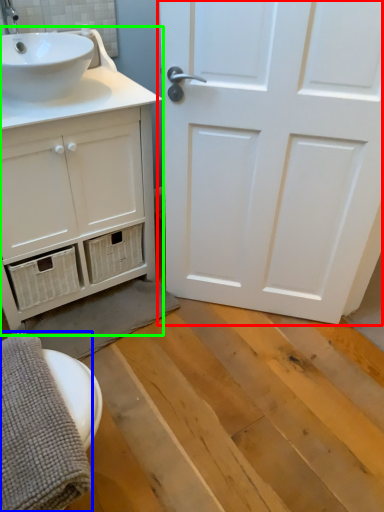
Question: Which object is the farthest from door (highlighted by a red box)? Choose among these: bath towel (highlighted by a blue box) or bathroom cabinet (highlighted by a green box).

Choices:
 (A) bath towel
 (B) bathroom cabinet

Answer: (A)